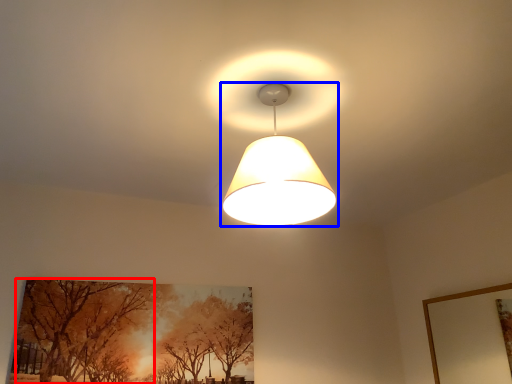
Question: Which object appears farthest to the camera in this image, tree (highlighted by a red box) or lamp (highlighted by a blue box)?

Choices:
 (A) tree
 (B) lamp

Answer: (A)